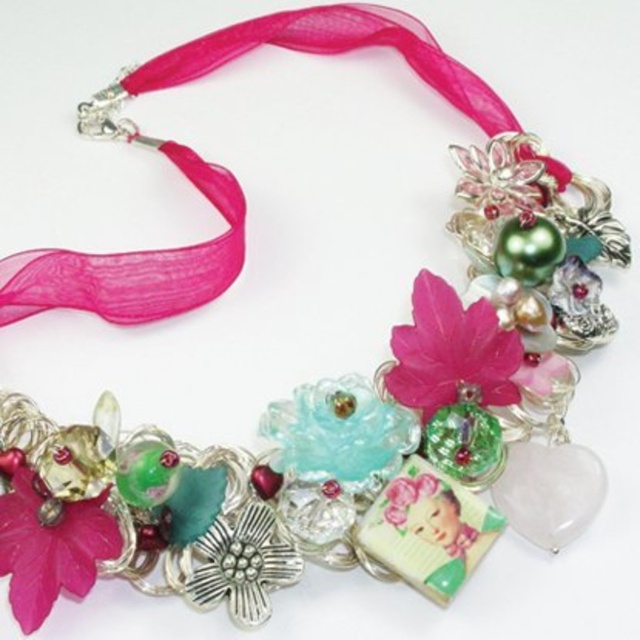
You are a jeweler who needs to adjust the spacing between the matte pink flower at center and the pink glossy flower at center on the necklace. The recommended distance between these two flowers is 10 inches. Based on the current distance, do you need to increase or decrease the space between them?

The current distance between the matte pink flower at center and the pink glossy flower at center is 8.61 inches, which is less than the recommended 10 inches. Therefore, you need to increase the space between them.

Looking at this image, you are standing in a gallery where this necklace is displayed. The camera is placed to capture the necklace from above. If you want to focus on the pink glossy flower at center without the camera, which direction should you move the camera?

The camera is 1.34 meters away from the pink glossy flower at center. To focus on the flower without the camera in the shot, move the camera closer to the flower so that it is within the desired framing.

You are designing a necklace and want to ensure proper balance. The matte pink flower at center and the pink glossy flower at center are both important elements. Which flower should you place closer to the center to maintain symmetry?

The matte pink flower at center is bigger than the pink glossy flower at center, so to maintain symmetry, the larger matte pink flower at center should be placed closer to the center while the smaller pink glossy flower at center can be positioned slightly away to balance the visual weight.